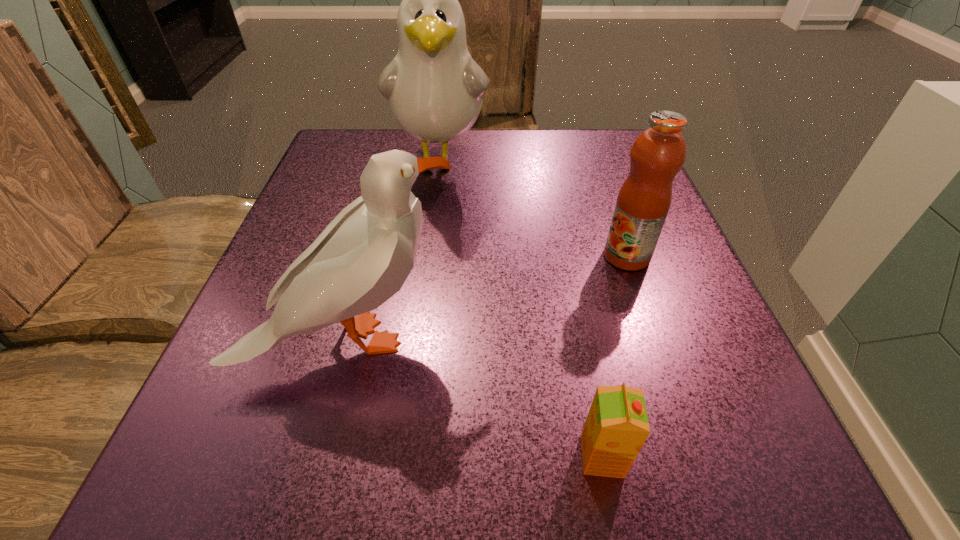
This screenshot has width=960, height=540. What are the coordinates of `free space at the left edge of the desktop` in the screenshot? It's located at (206, 386).

Where is `vacant area at the right edge of the desktop`? vacant area at the right edge of the desktop is located at coordinates (668, 282).

Locate an element on the screen. This screenshot has height=540, width=960. free region at the far left corner is located at coordinates (325, 176).

This screenshot has width=960, height=540. In the image, there is a desktop. Identify the location of vacant space at the near left corner. (217, 444).

Where is `free region at the far right corner of the desktop`? Image resolution: width=960 pixels, height=540 pixels. free region at the far right corner of the desktop is located at coordinates (564, 147).

The height and width of the screenshot is (540, 960). What are the coordinates of `unoccupied area between the second farthest object and the nearer gull` in the screenshot? It's located at (489, 298).

The width and height of the screenshot is (960, 540). In order to click on vacant point located between the third object from left to right and the second nearest object in this screenshot , I will do `click(477, 397)`.

Locate an element on the screen. This screenshot has width=960, height=540. empty location between the orange juice and the farther gull is located at coordinates (521, 308).

Where is `free space between the shortest object and the taller gull`? This screenshot has width=960, height=540. free space between the shortest object and the taller gull is located at coordinates (521, 308).

The image size is (960, 540). What are the coordinates of `unoccupied area between the second farthest object and the farther gull` in the screenshot? It's located at (534, 208).